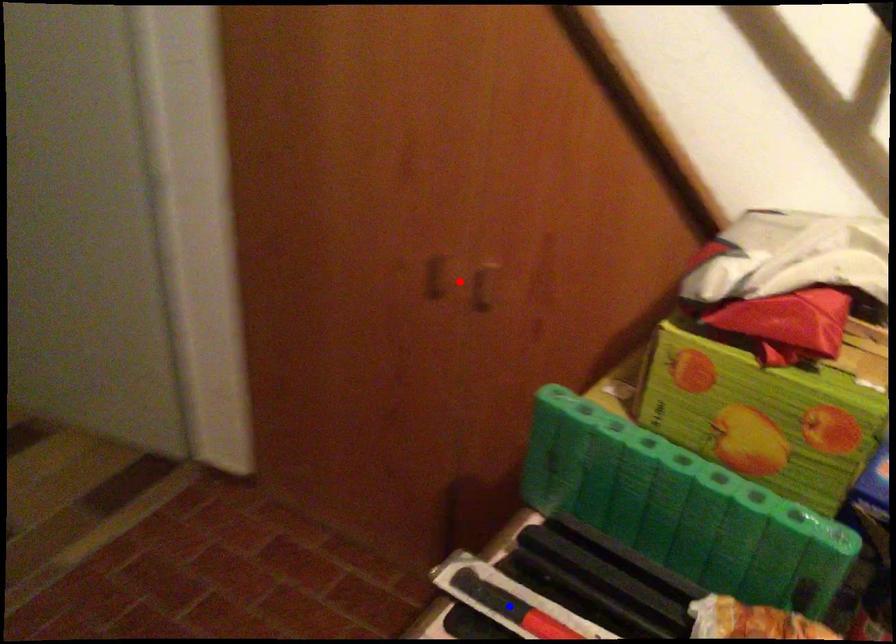
Question: Two points are marked on the image. Which point is closer to the camera?

Choices:
 (A) Blue point is closer.
 (B) Red point is closer.

Answer: (A)